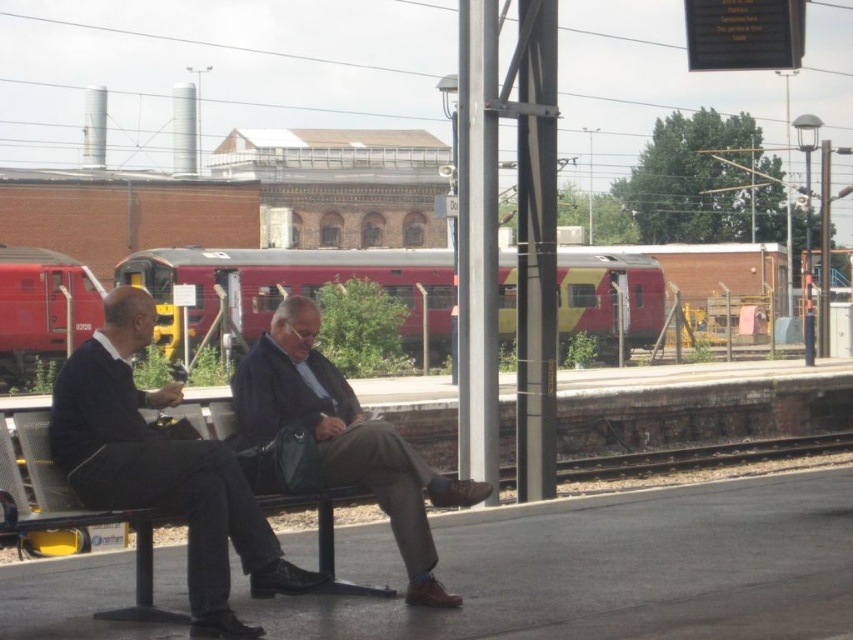
You are standing on the train station platform and see the dark blue suit at center and the red matte train at left. Which object is positioned to the right of the other?

The dark blue suit at center is to the right of the red matte train at left according to the description.